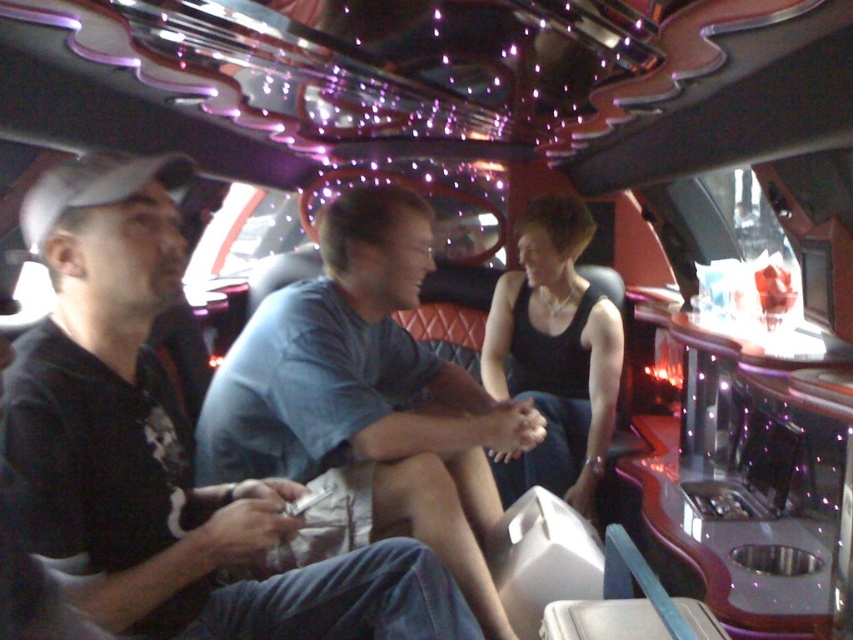
You are a photographer inside the limousine and want to take a photo of the blue cotton shirt at center and the black matte tank top at center. Which one is positioned lower in the frame?

The blue cotton shirt at center is located below black matte tank top at center, so the blue cotton shirt at center is positioned lower in the frame.

You are a photographer taking a photo of the two men in the luxurious vehicle. You need to ensure both the blue cotton shirt at center and the black matte tank top at center are clearly visible. Which clothing item should you focus on first to ensure it doesn t get cropped out of the frame?

The blue cotton shirt at center has a smaller size compared to the black matte tank top at center, so you should focus on ensuring the blue cotton shirt at center is fully in frame first since it might be easier to crop out due to its smaller size.